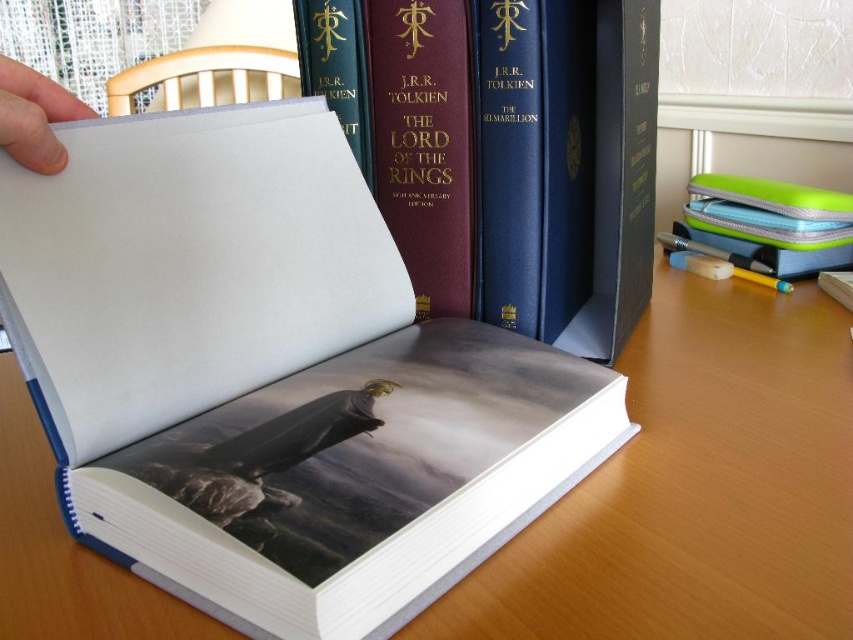
You are organizing a desk and need to place a small decorative item between the wooden table at center and the white paper at upper left. Considering their positions, where should you place the item to ensure it is between them?

The wooden table at center is much taller than the white paper at upper left, so placing the item on the table surface between them would position it appropriately between the two objects.

You are a student trying to reach the hardcover book at center on your desk. Your hand can extend 14 inches from your body. Can you comfortably reach it?

The hardcover book at center is 14.19 inches away from the viewer, which is slightly beyond the 14 inches your hand can extend. You might need to lean forward a bit to reach it comfortably.

You are organizing your desk and notice the hardcover book at center and the white paper at upper left. Which item is positioned higher from the ground?

The hardcover book at center is above the white paper at upper left, so it is positioned higher from the ground.